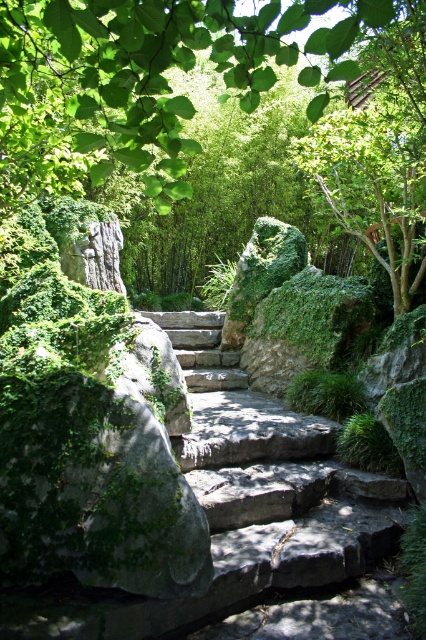
You are standing at the entrance of the garden and see the green leafy tree at upper center and the dark gray stone stairs at center. Which object is positioned to the left of the other?

The green leafy tree at upper center is to the left of dark gray stone stairs at center.

You are a gardener planning to place a new decorative statue exactly in the middle of the dark gray stone stairs at center. Considering the green leafy tree at upper center, will the statue be visible from the base of the tree? Please explain your reasoning based on their widths.

The green leafy tree at upper center is wider than the dark gray stone stairs at center. Since the statue is placed in the middle of the stairs, the tree might block the view due to its greater width, making the statue less visible from the base of the tree.

You are a hiker carrying a heavy backpack and need to reach the green leafy tree at upper center. The dark gray stone stairs at center are in your way. Can you walk around the stairs to get to the tree?

The green leafy tree at upper center is 2.32 meters away from dark gray stone stairs at center, so yes, you can walk around the stairs to reach the tree since there is enough space between them.